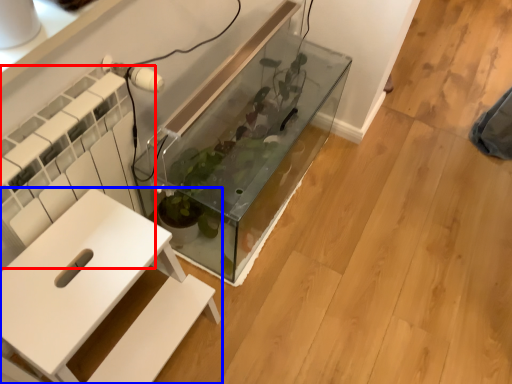
Question: Which of the following is the closest to the observer, radiator (highlighted by a red box) or furniture (highlighted by a blue box)?

Choices:
 (A) radiator
 (B) furniture

Answer: (B)